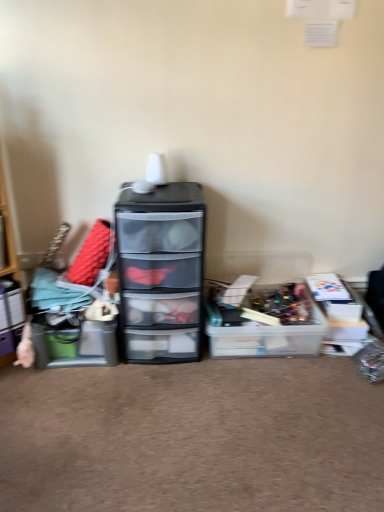
Question: Can you confirm if transparent plastic chest of drawers at center is wider than matte plastic storage box at left, which is the 1th storage box from left to right?

Choices:
 (A) no
 (B) yes

Answer: (B)

Question: Does transparent plastic chest of drawers at center have a smaller size compared to matte plastic storage box at left, which is the 1th storage box from left to right?

Choices:
 (A) no
 (B) yes

Answer: (A)

Question: Is matte plastic storage box at left, which is the 1th storage box from left to right, at the back of transparent plastic chest of drawers at center?

Choices:
 (A) yes
 (B) no

Answer: (B)

Question: Is transparent plastic chest of drawers at center facing towards matte plastic storage box at left, which is the 1th storage box from left to right?

Choices:
 (A) yes
 (B) no

Answer: (B)

Question: Is transparent plastic chest of drawers at center far away from matte plastic storage box at left, which is the 1th storage box from left to right?

Choices:
 (A) no
 (B) yes

Answer: (A)

Question: Does transparent plastic chest of drawers at center have a larger size compared to matte plastic storage box at left, the third storage box viewed from the right?

Choices:
 (A) no
 (B) yes

Answer: (B)

Question: Does translucent plastic storage box at center, which is the 1th storage box in right-to-left order, have a smaller size compared to transparent plastic chest of drawers at center?

Choices:
 (A) no
 (B) yes

Answer: (B)

Question: Is transparent plastic chest of drawers at center completely or partially inside translucent plastic storage box at center, positioned as the third storage box in left-to-right order?

Choices:
 (A) yes
 (B) no

Answer: (B)

Question: Considering the relative sizes of translucent plastic storage box at center, which is the 1th storage box in right-to-left order, and transparent plastic chest of drawers at center in the image provided, is translucent plastic storage box at center, which is the 1th storage box in right-to-left order, thinner than transparent plastic chest of drawers at center?

Choices:
 (A) no
 (B) yes

Answer: (A)

Question: Is translucent plastic storage box at center, which is the 1th storage box in right-to-left order, taller than transparent plastic chest of drawers at center?

Choices:
 (A) yes
 (B) no

Answer: (B)

Question: Does translucent plastic storage box at center, positioned as the third storage box in left-to-right order, have a larger size compared to transparent plastic chest of drawers at center?

Choices:
 (A) yes
 (B) no

Answer: (B)

Question: Does translucent plastic storage box at center, positioned as the third storage box in left-to-right order, appear on the left side of transparent plastic chest of drawers at center?

Choices:
 (A) no
 (B) yes

Answer: (A)

Question: Is matte plastic storage box at left, the 2th storage box positioned from the left, next to wooden shelf at left and touching it?

Choices:
 (A) yes
 (B) no

Answer: (B)